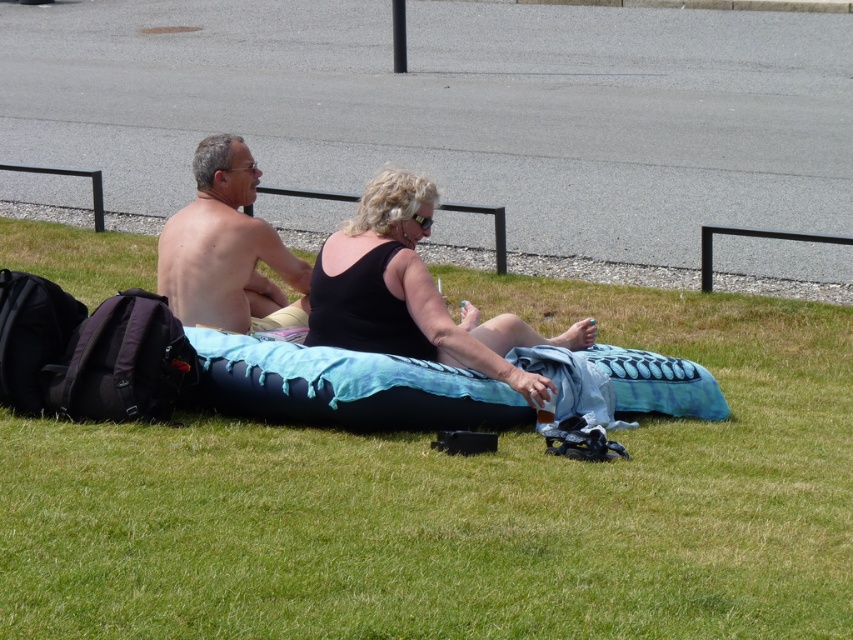
Does green grassy at center have a lesser height compared to skinny shirtless man at center?

Yes.

Can you confirm if green grassy at center is thinner than skinny shirtless man at center?

Correct, green grassy at center's width is less than skinny shirtless man at center's.

Which is in front, point (172, 605) or point (242, 294)?

Point (172, 605)

Where is `green grassy at center`? green grassy at center is located at coordinates (461, 504).

This screenshot has width=853, height=640. What do you see at coordinates (461, 504) in the screenshot?
I see `green grassy at center` at bounding box center [461, 504].

How far apart are green grassy at center and black matte tank top at center?

green grassy at center is 2.59 meters away from black matte tank top at center.

Does point (844, 579) lie in front of point (373, 230)?

Yes, point (844, 579) is closer to viewer.

The width and height of the screenshot is (853, 640). In order to click on green grassy at center in this screenshot , I will do `click(461, 504)`.

Does point (425, 189) come farther from viewer compared to point (210, 186)?

No.

Does point (403, 304) lie behind point (175, 280)?

That is False.

The width and height of the screenshot is (853, 640). In order to click on black matte tank top at center in this screenshot , I will do `click(412, 292)`.